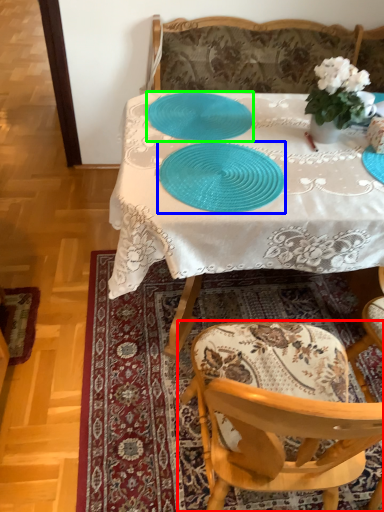
Question: Considering the real-world distances, which object is farthest from chair (highlighted by a red box)? tableware (highlighted by a blue box) or tableware (highlighted by a green box)?

Choices:
 (A) tableware
 (B) tableware

Answer: (B)